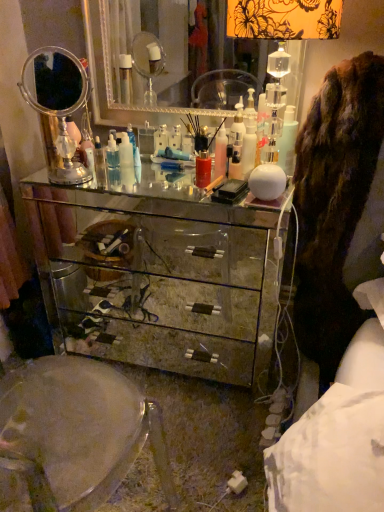
Question: From a real-world perspective, is silver mirrored dresser at center, the 2th mirror from the left, positioned above or below translucent plastic bottle at center, acting as the first toiletry starting from the front?

Choices:
 (A) above
 (B) below

Answer: (A)

Question: From the image's perspective, is silver mirrored dresser at center, the 2th mirror from the left, positioned above or below translucent plastic bottle at center, the 2th toiletry when ordered from left to right?

Choices:
 (A) above
 (B) below

Answer: (A)

Question: Which is nearer to the clear plastic bottle at center, placed as the 2th toiletry when sorted from front to back?

Choices:
 (A) translucent glass lampshade at upper right
 (B) mirrored glass chest of drawers at center
 (C) silver/metallic mirror at left, positioned as the second mirror in right-to-left order
 (D) silver mirrored dresser at center, the 2th mirror from the left
 (E) brown furry coat at right

Answer: (C)

Question: Estimate the real-world distances between objects in this image. Which object is farther from the brown furry coat at right?

Choices:
 (A) silver/metallic mirror at left, positioned as the second mirror in right-to-left order
 (B) translucent plastic bottle at center, which ranks as the second toiletry in back-to-front order
 (C) clear plastic bottle at center, which is the 2th toiletry from right to left
 (D) translucent glass lampshade at upper right
 (E) silver mirrored dresser at center, the 1th mirror viewed from the right

Answer: (E)